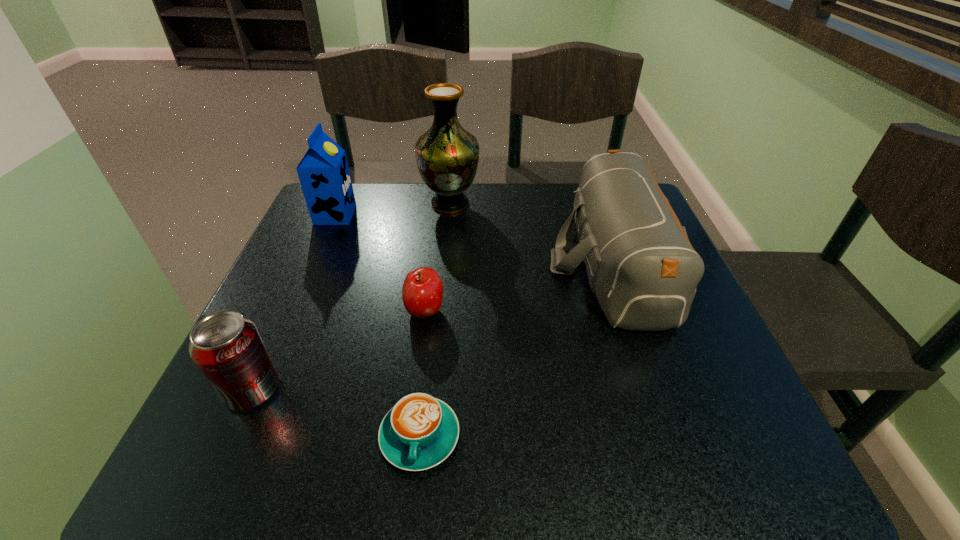
The image size is (960, 540). I want to click on vacant region located 0.150m on the back of the fourth tallest object, so click(289, 306).

Locate an element on the screen. The width and height of the screenshot is (960, 540). vacant region located 0.060m on the back of the apple is located at coordinates (429, 276).

Find the location of a particular element. This screenshot has width=960, height=540. vase that is at the far edge is located at coordinates (447, 155).

You are a GUI agent. You are given a task and a screenshot of the screen. Output one action in this format:
    pyautogui.click(x=<x>, y=<y>)
    Task: Click on the carton present at the far edge
    
    Given the screenshot: What is the action you would take?
    pyautogui.click(x=323, y=172)

Locate an element on the screen. duffel bag that is at the far edge is located at coordinates (640, 263).

Where is `object that is at the near edge`? The width and height of the screenshot is (960, 540). object that is at the near edge is located at coordinates (420, 431).

Locate an element on the screen. carton positioned at the left edge is located at coordinates (323, 172).

This screenshot has height=540, width=960. Identify the location of soda can located at the left edge. (227, 348).

Find the location of `object that is at the right edge`. object that is at the right edge is located at coordinates (640, 263).

Find the location of a particular element. The height and width of the screenshot is (540, 960). object that is at the far left corner is located at coordinates (323, 172).